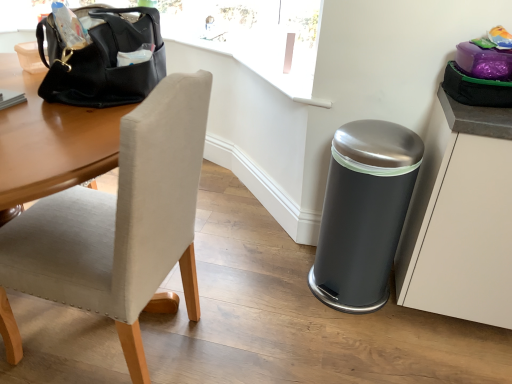
Question: In the image, is black leather handbag at upper left on the left side or the right side of satin silver trash can at lower right?

Choices:
 (A) right
 (B) left

Answer: (B)

Question: From the image's perspective, is black leather handbag at upper left located above or below satin silver trash can at lower right?

Choices:
 (A) below
 (B) above

Answer: (B)

Question: Estimate the real-world distances between objects in this image. Which object is farther from the white matte cabinet at right?

Choices:
 (A) satin silver trash can at lower right
 (B) black leather handbag at upper left
 (C) beige fabric chair at left

Answer: (B)

Question: Which object is the farthest from the white matte cabinet at right?

Choices:
 (A) black leather handbag at upper left
 (B) satin silver trash can at lower right
 (C) beige fabric chair at left

Answer: (A)